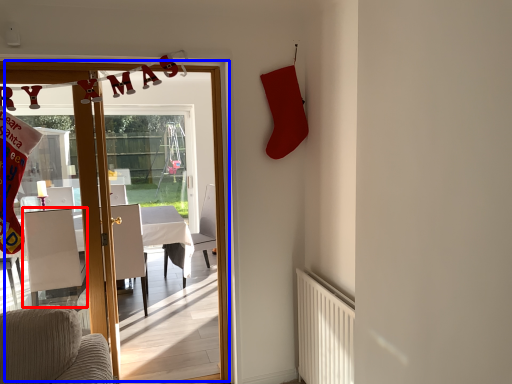
Question: Which object appears farthest to the camera in this image, armchair (highlighted by a red box) or door (highlighted by a blue box)?

Choices:
 (A) armchair
 (B) door

Answer: (A)